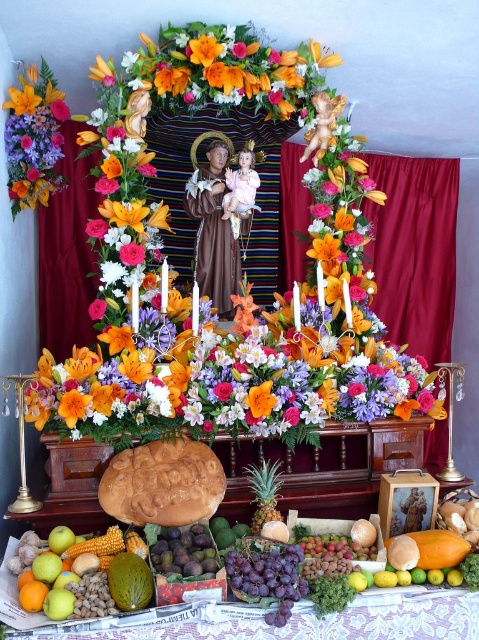
You are setting up a small candle holder on the lacquered wood table at lower center. The candle holder requires a space wider than the orange matte flower at center. Do you think the table has enough width for it?

Result: The lacquered wood table at lower center is wider than the orange matte flower at center, so yes, the table has enough width for the candle holder.

You are a decorator who needs to place a new candle holder between the matte wood statue at center and the gold textured statue at upper center. The candle holder requires 12 inches of space. Based on the altar setup, will there be enough space?

The distance between the matte wood statue at center and the gold textured statue at upper center is 10.55 inches. Since the candle holder requires 12 inches of space, there is not enough space to place it between them.

In the scene shown: You are a florist arranging flowers on the lacquered wood table at lower center. You need to place an orange matte flower at center exactly 70 centimeters away from the edge of the table. Can you do that?

The lacquered wood table at lower center is 69.02 centimeters from the orange matte flower at center, so you cannot place the orange matte flower at center exactly 70 centimeters away from the edge of the table because it is already 69.02 centimeters away.